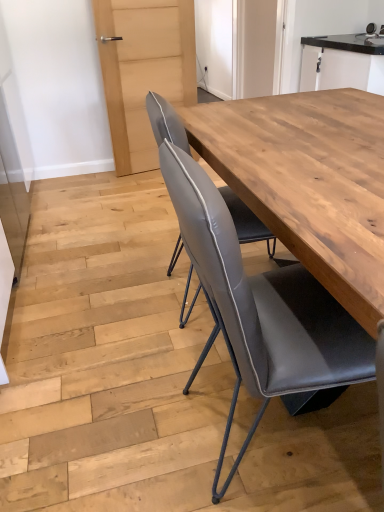
Question: Is matte gray leather chair at center facing towards black glossy cabinet at upper right?

Choices:
 (A) no
 (B) yes

Answer: (A)

Question: Is matte gray leather chair at center thinner than black glossy cabinet at upper right?

Choices:
 (A) no
 (B) yes

Answer: (A)

Question: Can you confirm if matte gray leather chair at center is positioned to the left of black glossy cabinet at upper right?

Choices:
 (A) yes
 (B) no

Answer: (A)

Question: Is black glossy cabinet at upper right located within matte gray leather chair at center?

Choices:
 (A) yes
 (B) no

Answer: (B)

Question: Does matte gray leather chair at center have a lesser height compared to black glossy cabinet at upper right?

Choices:
 (A) no
 (B) yes

Answer: (A)

Question: Looking at their shapes, would you say matte gray leather chair at center is wider or thinner than natural wood table at center?

Choices:
 (A) thin
 (B) wide

Answer: (A)

Question: Is matte gray leather chair at center taller or shorter than natural wood table at center?

Choices:
 (A) tall
 (B) short

Answer: (B)

Question: Based on their sizes in the image, would you say matte gray leather chair at center is bigger or smaller than natural wood table at center?

Choices:
 (A) big
 (B) small

Answer: (A)

Question: Is point (345, 358) closer or farther from the camera than point (276, 201)?

Choices:
 (A) closer
 (B) farther

Answer: (A)

Question: Considering the relative positions of natural wood table at center and matte gray leather chair at center in the image provided, is natural wood table at center to the left or to the right of matte gray leather chair at center?

Choices:
 (A) right
 (B) left

Answer: (B)

Question: Is natural wood table at center wider or thinner than matte gray leather chair at center?

Choices:
 (A) wide
 (B) thin

Answer: (A)

Question: Is natural wood table at center taller or shorter than matte gray leather chair at center?

Choices:
 (A) short
 (B) tall

Answer: (B)

Question: Relative to matte gray leather chair at center, is natural wood table at center in front or behind?

Choices:
 (A) behind
 (B) front

Answer: (A)

Question: Looking at their shapes, would you say black glossy cabinet at upper right is wider or thinner than matte gray leather chair at center?

Choices:
 (A) thin
 (B) wide

Answer: (A)

Question: Visually, is black glossy cabinet at upper right positioned to the left or to the right of matte gray leather chair at center?

Choices:
 (A) left
 (B) right

Answer: (B)